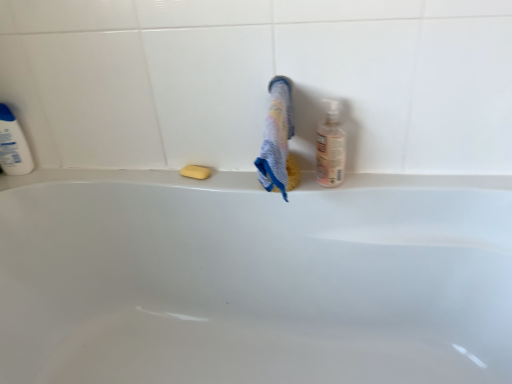
Find the location of a particular element. vacant point to the right of translucent plastic bottle at right, the 2th cleaning product in the left-to-right sequence is located at coordinates (380, 177).